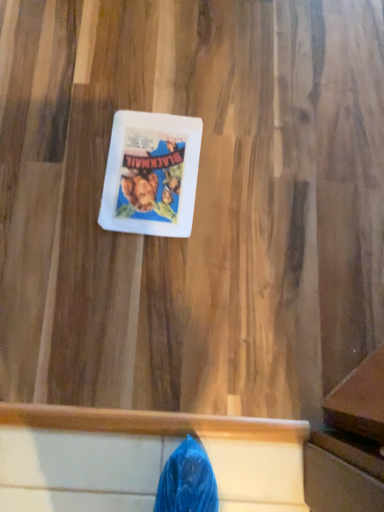
I want to click on blank area to the left of white matte comic book at center, so click(56, 165).